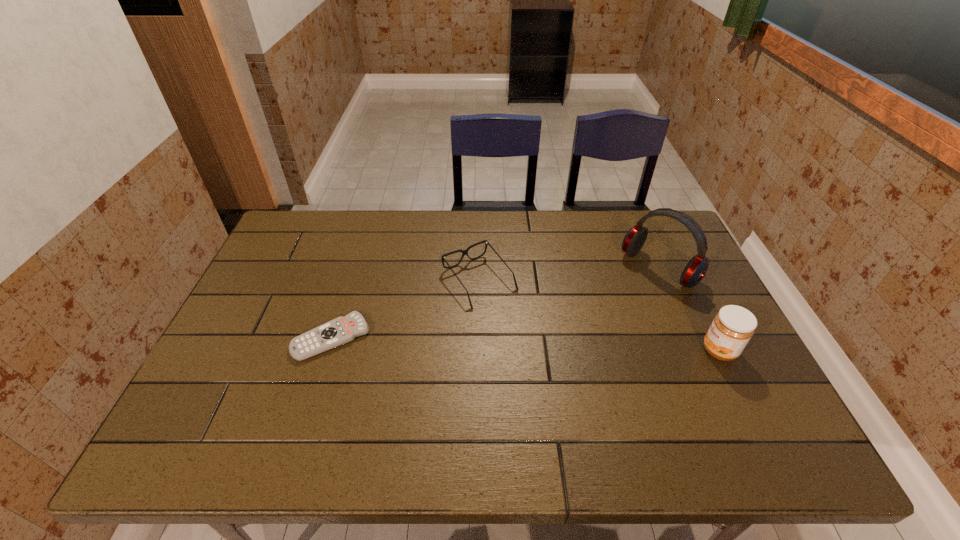
Locate an element on the screen. The width and height of the screenshot is (960, 540). free location at the far edge of the desktop is located at coordinates (371, 244).

The width and height of the screenshot is (960, 540). Find the location of `free spot at the near edge of the desktop`. free spot at the near edge of the desktop is located at coordinates (413, 414).

In the image, there is a desktop. Where is `vacant space at the left edge`? This screenshot has width=960, height=540. vacant space at the left edge is located at coordinates (267, 334).

Where is `vacant space at the right edge`? vacant space at the right edge is located at coordinates (685, 255).

What are the coordinates of `vacant region at the far left corner of the desktop` in the screenshot? It's located at (283, 252).

In the image, there is a desktop. Where is `blank space at the far right corner`? The image size is (960, 540). blank space at the far right corner is located at coordinates (640, 217).

Locate an element on the screen. vacant area that lies between the third tallest object and the jam is located at coordinates (599, 316).

Find the location of a particular element. Image resolution: width=960 pixels, height=540 pixels. free spot between the remote control and the earphone is located at coordinates (495, 303).

Where is `free space between the remote control and the second tallest object`? free space between the remote control and the second tallest object is located at coordinates (525, 344).

Identify the location of free space that is in between the tallest object and the remote control. The width and height of the screenshot is (960, 540). (495, 303).